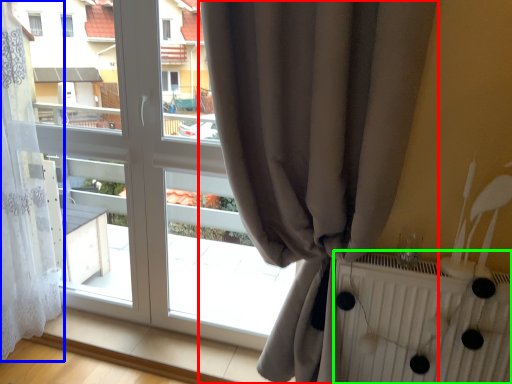
Question: Which object is the closest to the curtain (highlighted by a red box)? Choose among these: curtain (highlighted by a blue box) or radiator (highlighted by a green box).

Choices:
 (A) curtain
 (B) radiator

Answer: (B)